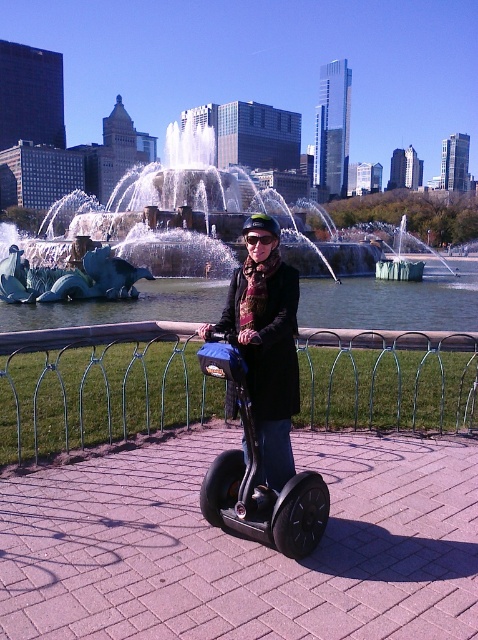
Based on the photo, between metal wire fence at lower center and matte black segway at center, which one appears on the right side from the viewer's perspective?

matte black segway at center is more to the right.

The width and height of the screenshot is (478, 640). Describe the element at coordinates (98, 387) in the screenshot. I see `metal wire fence at lower center` at that location.

Measure the distance between point [98,429] and camera.

The distance of point [98,429] from camera is 5.28 meters.

The height and width of the screenshot is (640, 478). In order to click on metal wire fence at lower center in this screenshot , I will do `click(98, 387)`.

Which is behind, point (279, 456) or point (237, 499)?

The point (279, 456) is more distant.

Does matte black segway at center have a lesser height compared to black rubber segway at center?

Indeed, matte black segway at center has a lesser height compared to black rubber segway at center.

Between point (279, 337) and point (236, 525), which one is positioned in front?

Point (279, 337)

You are a GUI agent. You are given a task and a screenshot of the screen. Output one action in this format:
    pyautogui.click(x=<x>, y=<y>)
    Task: Click on the matte black segway at center
    The image size is (478, 640).
    Given the screenshot: What is the action you would take?
    pyautogui.click(x=267, y=346)

Which of these two, polished stone fountain at center or matte black segway at center, stands shorter?

With less height is matte black segway at center.

Who is more distant from viewer, (180,140) or (284,310)?

The point (180,140) is behind.

Which is in front, point (195, 256) or point (258, 378)?

Point (258, 378) is in front.

Locate an element on the screen. This screenshot has height=640, width=478. polished stone fountain at center is located at coordinates (156, 227).